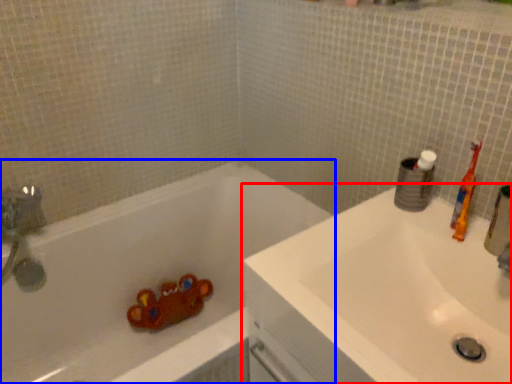
Question: Which object appears closest to the camera in this image, sink (highlighted by a red box) or bathtub (highlighted by a blue box)?

Choices:
 (A) sink
 (B) bathtub

Answer: (A)